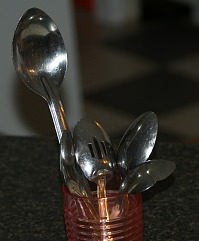
You are a GUI agent. You are given a task and a screenshot of the screen. Output one action in this format:
    pyautogui.click(x=<x>, y=<y>)
    Task: Click on the table
    This screenshot has height=241, width=199.
    Given the screenshot: What is the action you would take?
    pyautogui.click(x=33, y=168)